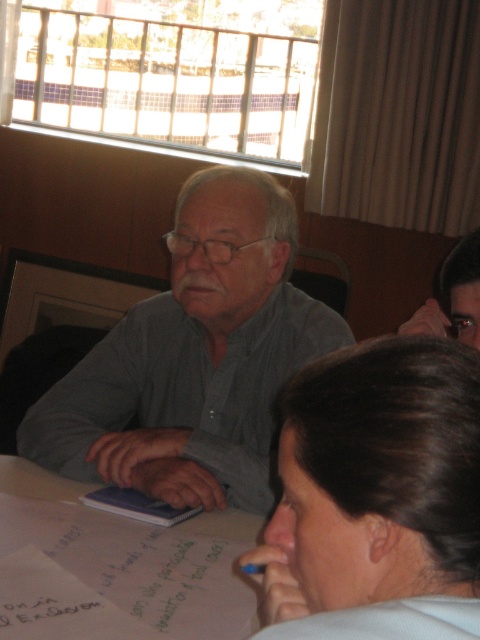
What is the color of the shirt worn by the person at the coordinates specified by the point labeled as point (x=194, y=358)?

The gray shirt at center is marked by the point labeled (x=194, y=358), so the color is gray.

You are organizing a presentation and need to place a 12 inch wide laptop between the gray shirt at center and the white paper at center on the table. Based on their widths, can the laptop fit between them?

The gray shirt at center might be wider than white paper at center, so the laptop may not fit between them if the shirt is wider than the paper. Check their exact widths to confirm.